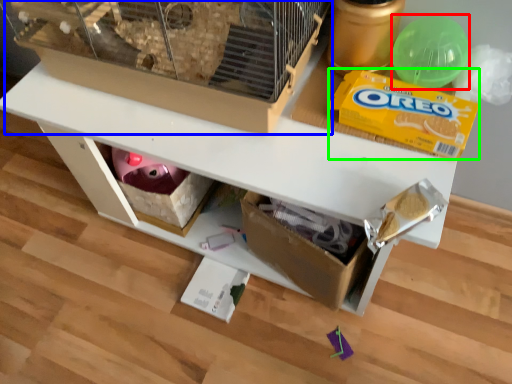
Question: Which is nearer to the toy (highlighted by a red box)? bird cage (highlighted by a blue box) or cereal (highlighted by a green box).

Choices:
 (A) bird cage
 (B) cereal

Answer: (B)